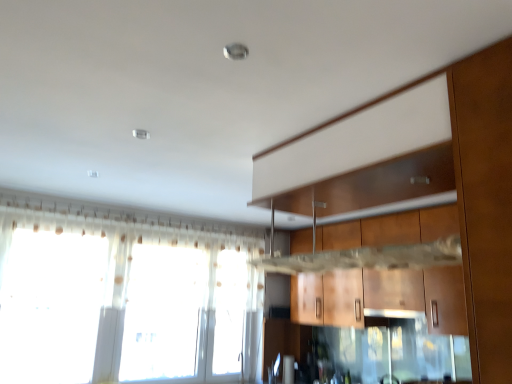
Question: From a real-world perspective, is translucent fabric window at lower left under matte white exhaust hood at center?

Choices:
 (A) yes
 (B) no

Answer: (B)

Question: Can you confirm if translucent fabric window at lower left is taller than matte white exhaust hood at center?

Choices:
 (A) no
 (B) yes

Answer: (B)

Question: Can you confirm if translucent fabric window at lower left is bigger than matte white exhaust hood at center?

Choices:
 (A) yes
 (B) no

Answer: (A)

Question: From the image's perspective, is translucent fabric window at lower left on matte white exhaust hood at center?

Choices:
 (A) no
 (B) yes

Answer: (B)

Question: Is translucent fabric window at lower left positioned far away from matte white exhaust hood at center?

Choices:
 (A) no
 (B) yes

Answer: (B)

Question: In terms of size, does wooden cabinet at center appear bigger or smaller than translucent fabric window at lower left?

Choices:
 (A) big
 (B) small

Answer: (B)

Question: In the image, is wooden cabinet at center on the left side or the right side of translucent fabric window at lower left?

Choices:
 (A) left
 (B) right

Answer: (B)

Question: In the image, is wooden cabinet at center positioned in front of or behind translucent fabric window at lower left?

Choices:
 (A) front
 (B) behind

Answer: (A)

Question: Is point (337, 223) closer or farther from the camera than point (196, 274)?

Choices:
 (A) farther
 (B) closer

Answer: (B)

Question: Is wooden cabinet at center to the left or to the right of matte white exhaust hood at center in the image?

Choices:
 (A) left
 (B) right

Answer: (A)

Question: From a real-world perspective, is wooden cabinet at center physically located above or below matte white exhaust hood at center?

Choices:
 (A) below
 (B) above

Answer: (B)

Question: In terms of height, does wooden cabinet at center look taller or shorter compared to matte white exhaust hood at center?

Choices:
 (A) short
 (B) tall

Answer: (B)

Question: From the image's perspective, is wooden cabinet at center located above or below matte white exhaust hood at center?

Choices:
 (A) above
 (B) below

Answer: (A)

Question: Is matte white exhaust hood at center to the left or to the right of wooden cabinet at center in the image?

Choices:
 (A) right
 (B) left

Answer: (A)

Question: From the image's perspective, is matte white exhaust hood at center positioned above or below wooden cabinet at center?

Choices:
 (A) above
 (B) below

Answer: (B)